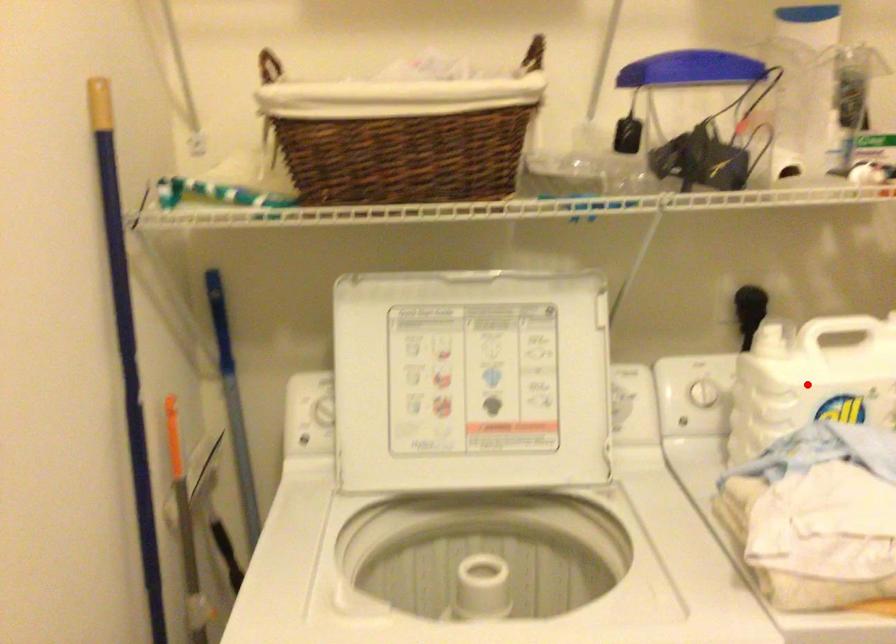
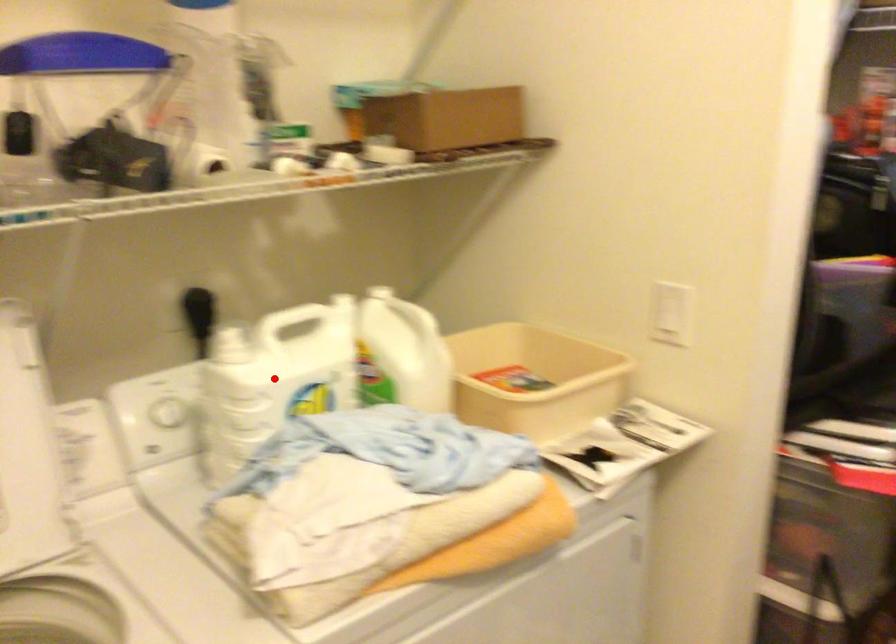
I am providing you with two images of the same scene from different viewpoints. A red point is marked on the first image and another point is marked on the second image. Is the marked point in image1 the same physical position as the marked point in image2?

Yes